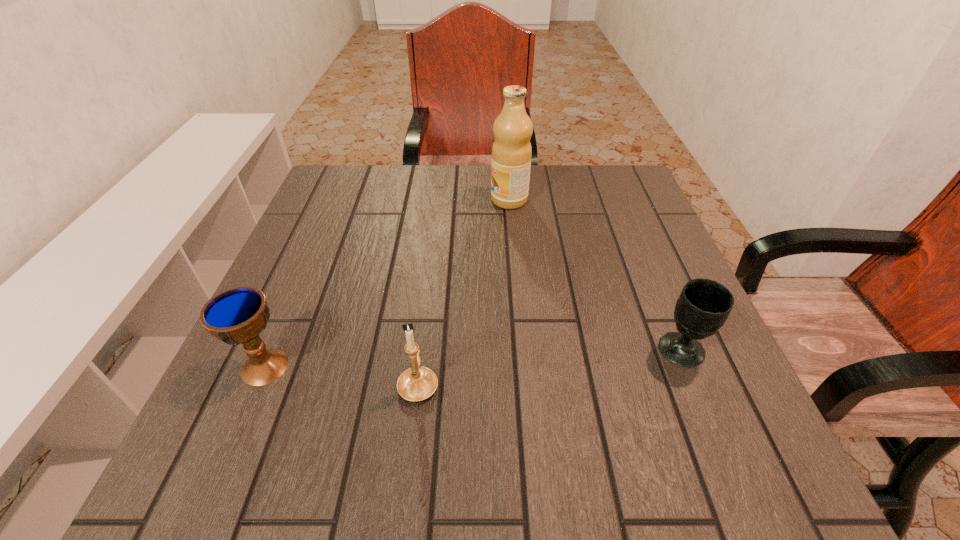
Image resolution: width=960 pixels, height=540 pixels. What are the coordinates of `olive oil` in the screenshot? It's located at (511, 152).

Where is `the tallest object`? This screenshot has height=540, width=960. the tallest object is located at coordinates (511, 152).

The height and width of the screenshot is (540, 960). I want to click on the third object from right to left, so click(417, 383).

Identify the location of the leftmost object. pyautogui.click(x=237, y=315).

Where is `the right chalice`? The width and height of the screenshot is (960, 540). the right chalice is located at coordinates (704, 305).

Image resolution: width=960 pixels, height=540 pixels. I want to click on vacant point located 0.330m on the label of the olive oil, so click(x=363, y=200).

You are a GUI agent. You are given a task and a screenshot of the screen. Output one action in this format:
    pyautogui.click(x=<x>, y=<y>)
    Task: Click on the vacant point located 0.290m on the label of the olive oil
    This screenshot has height=540, width=960.
    Given the screenshot: What is the action you would take?
    pyautogui.click(x=379, y=200)

What are the coordinates of `vacant space located on the label of the olive oil` in the screenshot? It's located at (336, 200).

Locate an element on the screen. Image resolution: width=960 pixels, height=540 pixels. vacant area situated on the handle side of the candle holder is located at coordinates (432, 267).

I want to click on free spot located on the handle side of the candle holder, so click(430, 289).